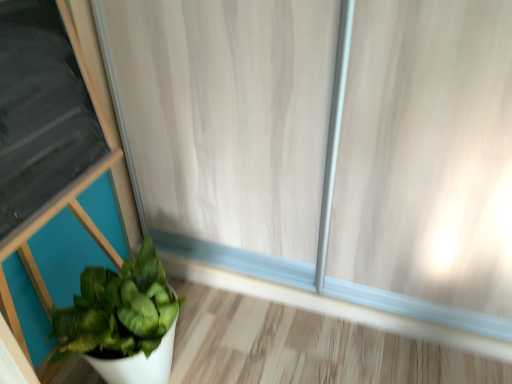
What do you see at coordinates (122, 321) in the screenshot? I see `white glossy pot at lower left` at bounding box center [122, 321].

What are the coordinates of `white glossy pot at lower left` in the screenshot? It's located at (122, 321).

I want to click on white glossy pot at lower left, so click(x=122, y=321).